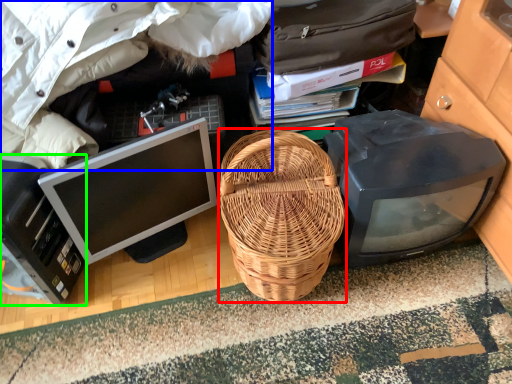
Question: Estimate the real-world distances between objects in this image. Which object is closer to picnic basket (highlighted by a red box), clothing (highlighted by a blue box) or computer (highlighted by a green box)?

Choices:
 (A) clothing
 (B) computer

Answer: (A)